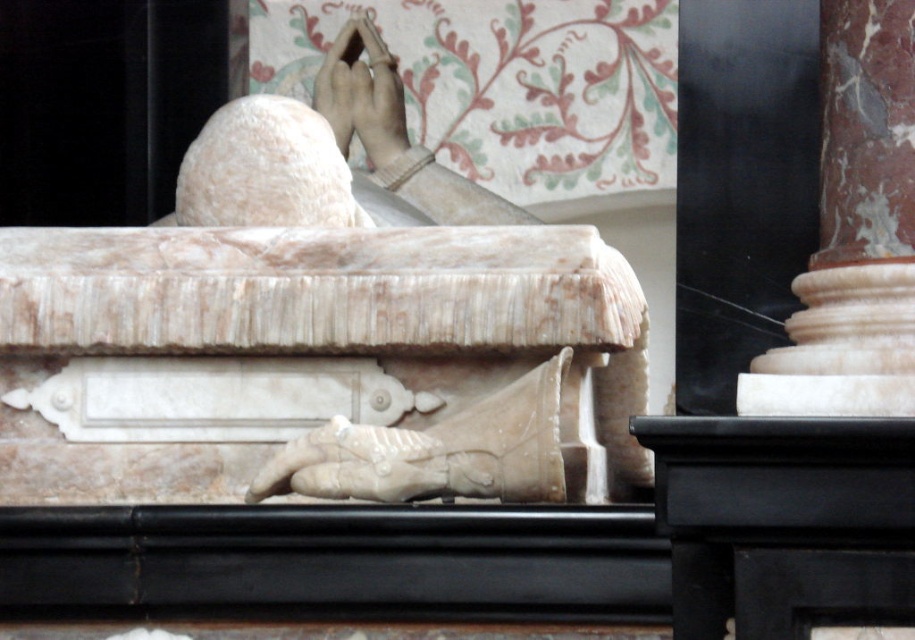
You are standing in the cathedral and want to take a photo of the white marble statue at center. The camera you are using has a zoom lens that can focus on objects within a 0.5 radius around a specific point. Is the white marble statue at center within the camera focus range if you aim at point (x=329, y=326)?

The white marble statue at center is located exactly at point (x=329, y=326), so it is within the camera focus range of 0.5 radius around that point.

You are an art conservator examining the marble monument. You notice the white marble statue at center and the matte stone hand at upper center. Which object is closer to you in the scene?

The white marble statue at center is closer to you because it is in front of the matte stone hand at upper center.